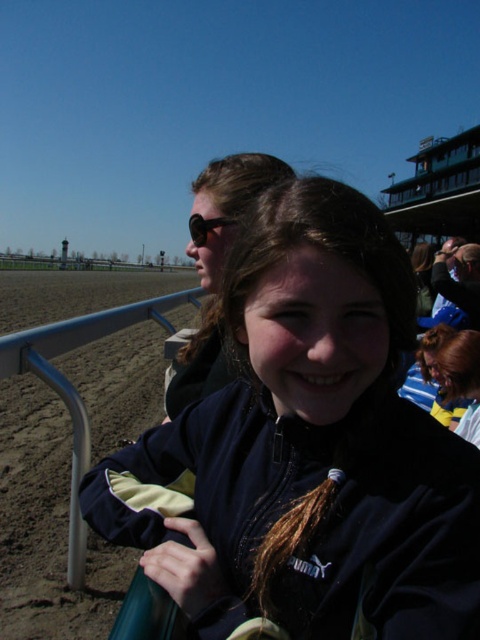
Question: Is navy blue jacket at center below matte black sunglasses at upper center?

Choices:
 (A) yes
 (B) no

Answer: (A)

Question: Which is nearer to the matte black sunglasses at upper center?

Choices:
 (A) matte black jacket at center
 (B) navy blue jacket at center

Answer: (A)

Question: Where is matte black jacket at center located in relation to matte black sunglasses at upper center in the image?

Choices:
 (A) below
 (B) above

Answer: (A)

Question: Which object is farther from the camera taking this photo?

Choices:
 (A) matte black jacket at center
 (B) navy blue jacket at center

Answer: (A)

Question: Is the position of navy blue jacket at center more distant than that of matte black sunglasses at upper center?

Choices:
 (A) no
 (B) yes

Answer: (A)

Question: Which point is closer to the camera?

Choices:
 (A) (199, 228)
 (B) (228, 273)
 (C) (243, 163)

Answer: (B)